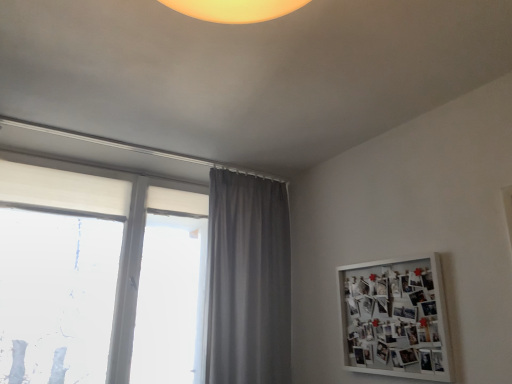
You are a GUI agent. You are given a task and a screenshot of the screen. Output one action in this format:
    pyautogui.click(x=<x>, y=<y>)
    Task: Click on the gray fabric curtain at center
    This screenshot has width=512, height=384.
    Given the screenshot: What is the action you would take?
    pyautogui.click(x=248, y=280)

Does white matte window at left appear on the left side of gray fabric curtain at center?

Correct, you'll find white matte window at left to the left of gray fabric curtain at center.

Is white matte window at left in contact with gray fabric curtain at center?

No, white matte window at left is not touching gray fabric curtain at center.

Which is correct: white matte window at left is inside gray fabric curtain at center, or outside of it?

white matte window at left is not enclosed by gray fabric curtain at center.

From the picture: Is white matte window at left further to camera compared to gray fabric curtain at center?

No, it is not.

Between gray fabric curtain at center and white matte bulletin board at upper right, which one is positioned behind?

gray fabric curtain at center.

From the image's perspective, between gray fabric curtain at center and white matte bulletin board at upper right, who is located below?

From the image's view, white matte bulletin board at upper right is below.

Who is smaller, gray fabric curtain at center or white matte bulletin board at upper right?

white matte bulletin board at upper right is smaller.

Is gray fabric curtain at center directly adjacent to white matte bulletin board at upper right?

No, gray fabric curtain at center is not next to white matte bulletin board at upper right.

Is white matte window at left oriented towards white matte bulletin board at upper right?

No, white matte window at left is not oriented towards white matte bulletin board at upper right.

Looking at this image, can you confirm if white matte window at left is thinner than white matte bulletin board at upper right?

No, white matte window at left is not thinner than white matte bulletin board at upper right.

From the image's perspective, is white matte window at left on white matte bulletin board at upper right?

Indeed, from the image's perspective, white matte window at left is shown above white matte bulletin board at upper right.

In the image, is gray fabric curtain at center positioned in front of or behind white matte window at left?

In the image, gray fabric curtain at center appears behind white matte window at left.

Is gray fabric curtain at center inside the boundaries of white matte window at left, or outside?

gray fabric curtain at center lies outside white matte window at left.

In the scene shown: Considering the relative sizes of gray fabric curtain at center and white matte window at left in the image provided, is gray fabric curtain at center thinner than white matte window at left?

Incorrect, the width of gray fabric curtain at center is not less than that of white matte window at left.

Looking at this image, between gray fabric curtain at center and white matte window at left, which one has more height?

With more height is white matte window at left.

I want to click on curtain located behind the white matte bulletin board at upper right, so click(x=248, y=280).

In the scene shown: Is white matte bulletin board at upper right completely or partially outside of gray fabric curtain at center?

white matte bulletin board at upper right lies outside gray fabric curtain at center's area.

Is white matte bulletin board at upper right at the right side of gray fabric curtain at center?

Indeed, white matte bulletin board at upper right is positioned on the right side of gray fabric curtain at center.

How different are the orientations of white matte bulletin board at upper right and gray fabric curtain at center in degrees?

There is a 85.3-degree angle between the facing directions of white matte bulletin board at upper right and gray fabric curtain at center.

In the image, is white matte bulletin board at upper right on the left side or the right side of white matte window at left?

From the image, it's evident that white matte bulletin board at upper right is to the right of white matte window at left.

Is point (359, 295) positioned in front of point (52, 180)?

Yes, point (359, 295) is in front of point (52, 180).

Is white matte bulletin board at upper right located outside white matte window at left?

Yes, white matte bulletin board at upper right is not within white matte window at left.

At what (x,y) coordinates should I click in order to perform the action: click on curtain above the white matte window at left (from a real-world perspective). Please return your answer as a coordinate pair (x, y). Looking at the image, I should click on (248, 280).

At what (x,y) coordinates should I click in order to perform the action: click on bulletin board on the right side of gray fabric curtain at center. Please return your answer as a coordinate pair (x, y). Looking at the image, I should click on (395, 319).

Which object lies further to the anchor point white matte window at left, gray fabric curtain at center or white matte bulletin board at upper right?

white matte bulletin board at upper right is further to white matte window at left.

From the picture: Estimate the real-world distances between objects in this image. Which object is closer to gray fabric curtain at center, white matte bulletin board at upper right or white matte window at left?

white matte window at left lies closer to gray fabric curtain at center than the other object.

Which object lies nearer to the anchor point gray fabric curtain at center, white matte window at left or white matte bulletin board at upper right?

white matte window at left is positioned closer to the anchor gray fabric curtain at center.

Looking at this image, which object lies further to the anchor point white matte bulletin board at upper right, gray fabric curtain at center or white matte window at left?

white matte window at left is further to white matte bulletin board at upper right.

From the picture: When comparing their distances from white matte window at left, does white matte bulletin board at upper right or gray fabric curtain at center seem closer?

gray fabric curtain at center lies closer to white matte window at left than the other object.

Looking at the image, which one is located further to white matte bulletin board at upper right, white matte window at left or gray fabric curtain at center?

Among the two, white matte window at left is located further to white matte bulletin board at upper right.

At what (x,y) coordinates should I click in order to perform the action: click on curtain located between white matte window at left and white matte bulletin board at upper right in the left-right direction. Please return your answer as a coordinate pair (x, y). Image resolution: width=512 pixels, height=384 pixels. Looking at the image, I should click on click(248, 280).